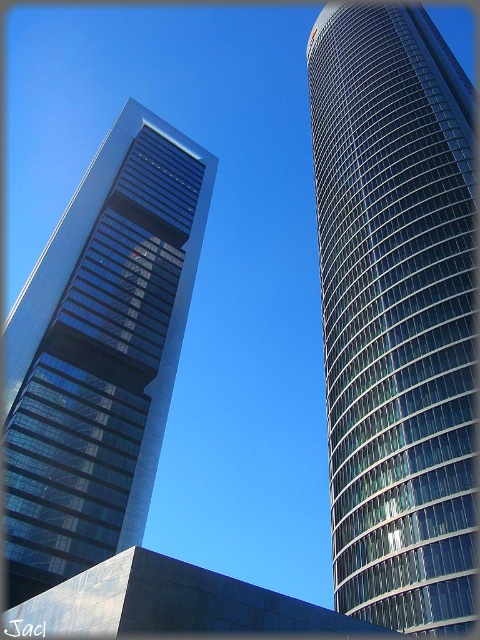
You are standing in the middle of the street between the shiny glass skyscraper at right and the transparent glass skyscraper at left. Which building is closer to your right side?

The shiny glass skyscraper at right is closer to your right side because it is positioned to the right of the transparent glass skyscraper at left.

You are standing at the point labeled point (396, 312) in the image. Looking around, you see the shiny glass skyscraper at right and the other building on the left. Which building is your point located on?

The point (396, 312) is on the shiny glass skyscraper at right.

You are standing at the center of the image and want to locate the shiny glass skyscraper at right. According to the coordinates provided, in which direction should you look to find it?

The shiny glass skyscraper at right is located at point coordinates, so you should look to the right side of the image to find it since it is positioned at the right side.